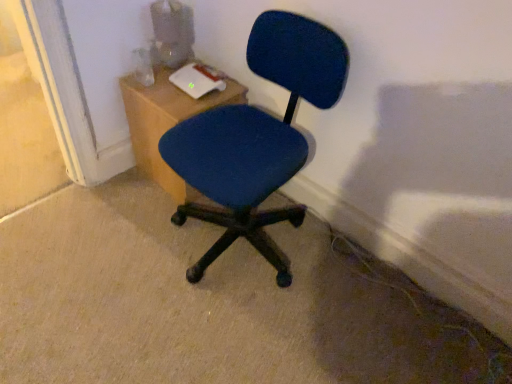
Question: Do you think blue fabric chair at center is within wooden table at upper left, or outside of it?

Choices:
 (A) outside
 (B) inside

Answer: (A)

Question: Considering the positions of blue fabric chair at center and wooden table at upper left in the image, is blue fabric chair at center taller or shorter than wooden table at upper left?

Choices:
 (A) short
 (B) tall

Answer: (B)

Question: Is blue fabric chair at center bigger or smaller than wooden table at upper left?

Choices:
 (A) big
 (B) small

Answer: (A)

Question: From the image's perspective, is wooden table at upper left located above or below blue fabric chair at center?

Choices:
 (A) above
 (B) below

Answer: (A)

Question: Relative to blue fabric chair at center, is wooden table at upper left in front or behind?

Choices:
 (A) front
 (B) behind

Answer: (B)

Question: Is point (140, 92) positioned closer to the camera than point (293, 57)?

Choices:
 (A) closer
 (B) farther

Answer: (B)

Question: From a real-world perspective, is wooden table at upper left physically located above or below blue fabric chair at center?

Choices:
 (A) above
 (B) below

Answer: (B)